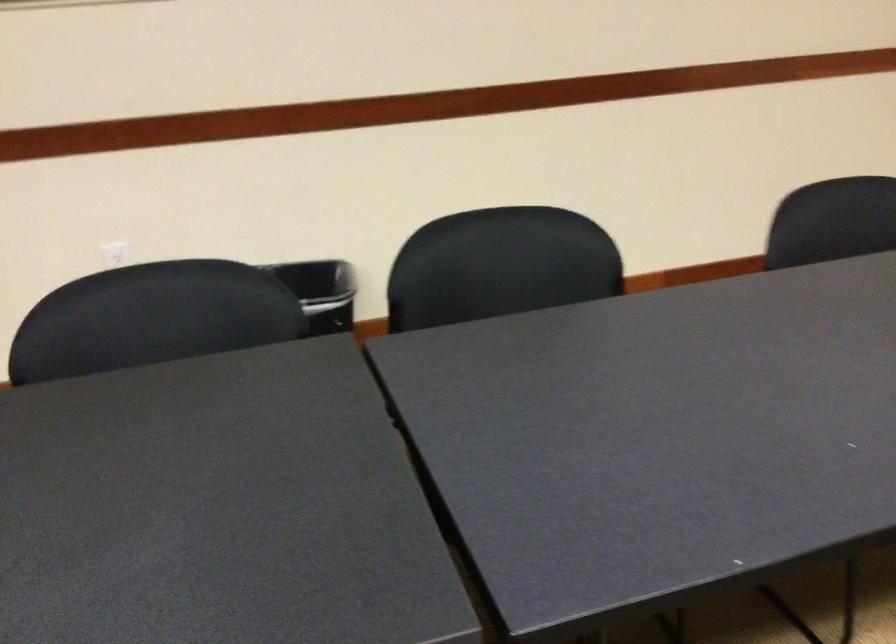
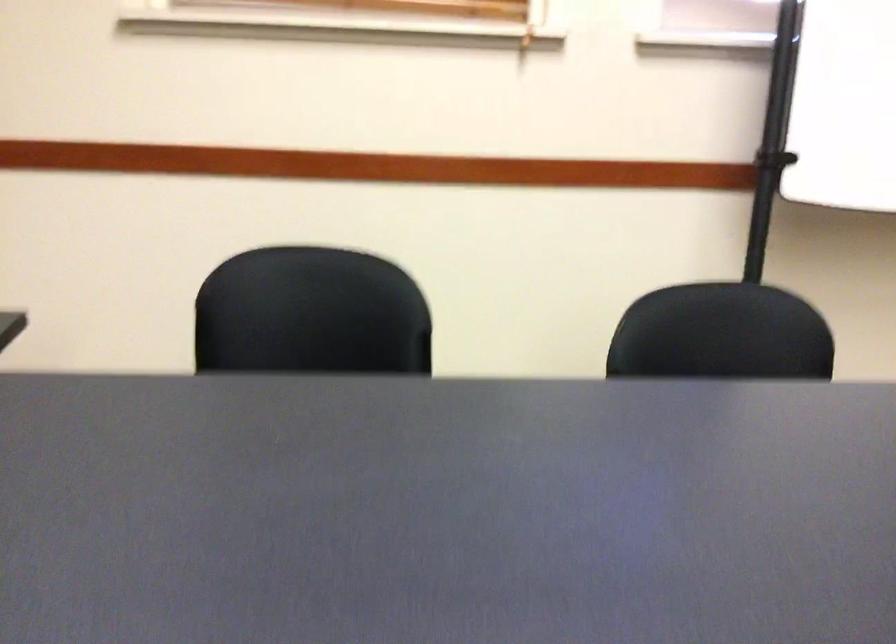
Question: Based on the continuous images, in which direction is the camera rotating? Reply with the corresponding letter.

Choices:
 (A) Left
 (B) Right
 (C) Up
 (D) Down

Answer: (B)